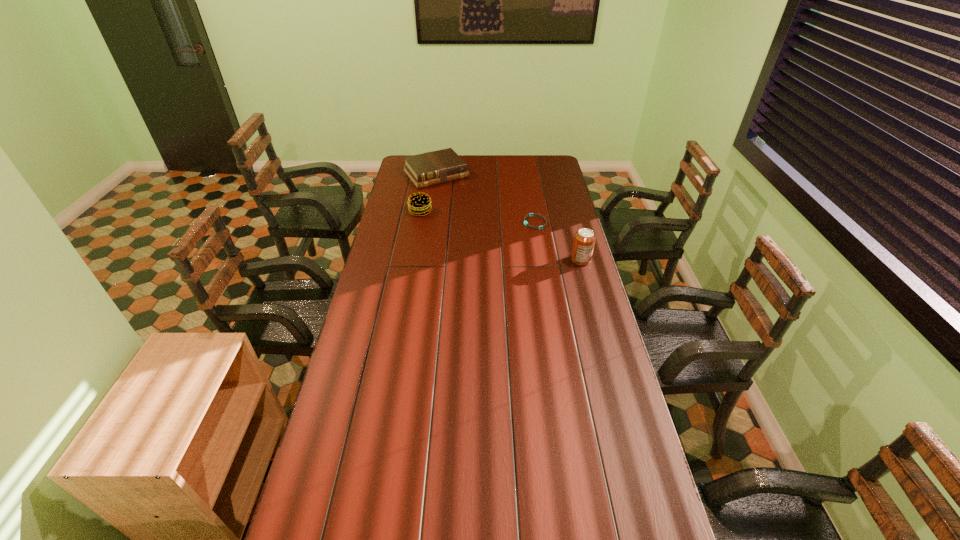
What are the coordinates of `blank space at the far edge of the desktop` in the screenshot? It's located at (480, 163).

Where is `free space at the left edge of the desktop`? free space at the left edge of the desktop is located at coordinates (413, 228).

In the image, there is a desktop. Where is `vacant space at the right edge`? This screenshot has height=540, width=960. vacant space at the right edge is located at coordinates (578, 326).

The height and width of the screenshot is (540, 960). In order to click on vacant space at the far right corner in this screenshot , I will do `click(553, 173)`.

This screenshot has width=960, height=540. Identify the location of empty space that is in between the Bible and the shortest object. (486, 198).

At what (x,y) coordinates should I click in order to perform the action: click on unoccupied area between the shortest object and the farthest object. Please return your answer as a coordinate pair (x, y). Looking at the image, I should click on (486, 198).

The height and width of the screenshot is (540, 960). Identify the location of free spot between the patty and the Bible. (428, 193).

Locate an element on the screen. This screenshot has height=540, width=960. free space between the nearest object and the patty is located at coordinates (500, 236).

Locate an element on the screen. This screenshot has height=540, width=960. empty space that is in between the patty and the tallest object is located at coordinates (500, 236).

Find the location of `vacant space that's between the Bible and the rightmost object`. vacant space that's between the Bible and the rightmost object is located at coordinates (509, 217).